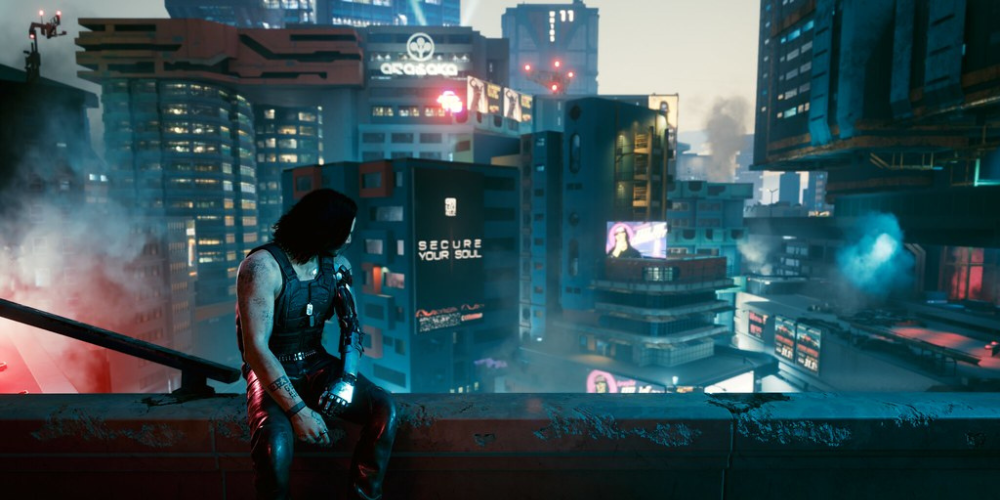
At what (x,y) coordinates should I click in order to perform the action: click on ledge. Please return your answer as a coordinate pair (x, y). Looking at the image, I should click on (476, 397).